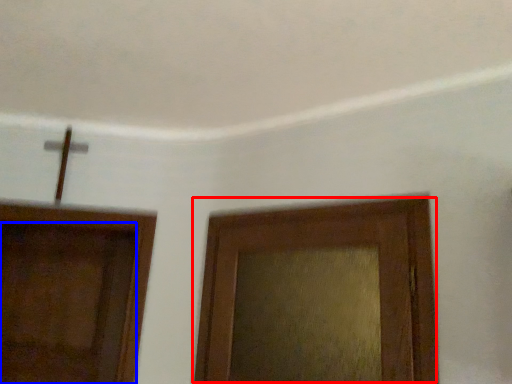
Question: Which object is further to the camera taking this photo, door (highlighted by a red box) or door (highlighted by a blue box)?

Choices:
 (A) door
 (B) door

Answer: (B)